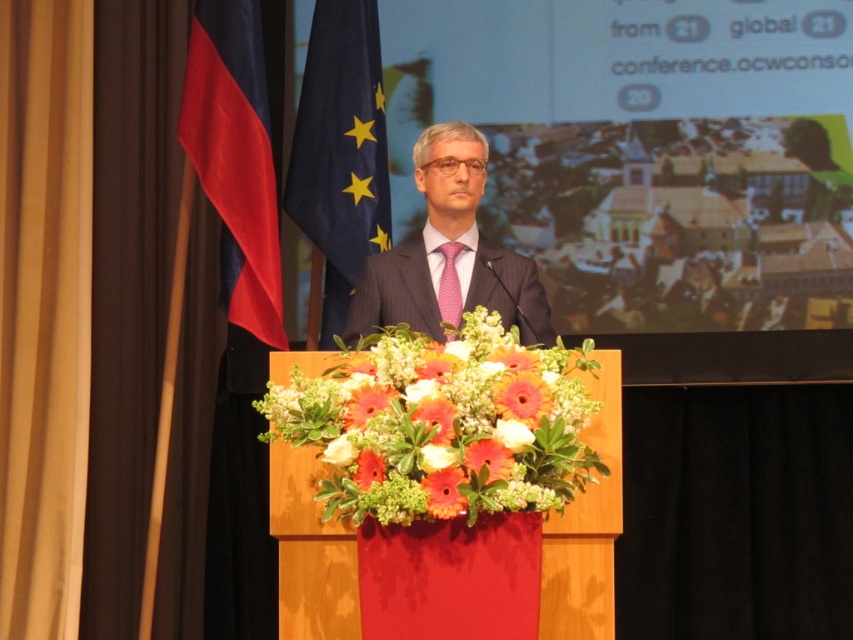
Is vibrant orange petals at center smaller than matte black suit at center?

Actually, vibrant orange petals at center might be larger than matte black suit at center.

Does point (454, 483) come behind point (491, 291)?

No.

This screenshot has width=853, height=640. Find the location of `vibrant orange petals at center`. vibrant orange petals at center is located at coordinates (440, 422).

Is point (505, 280) closer to viewer compared to point (459, 252)?

Yes, point (505, 280) is in front of point (459, 252).

Does matte black suit at center come behind pink dotted fabric tie at center?

No, it is in front of pink dotted fabric tie at center.

Image resolution: width=853 pixels, height=640 pixels. Identify the location of matte black suit at center. (448, 253).

Identify the location of matte black suit at center. This screenshot has width=853, height=640. (448, 253).

Who is positioned more to the left, blue fabric flag at upper left or orange matte flower at center?

blue fabric flag at upper left

At what (x,y) coordinates should I click in order to perform the action: click on blue fabric flag at upper left. Please return your answer as a coordinate pair (x, y). The height and width of the screenshot is (640, 853). Looking at the image, I should click on (340, 152).

Identify the location of blue fabric flag at upper left. Image resolution: width=853 pixels, height=640 pixels. (340, 152).